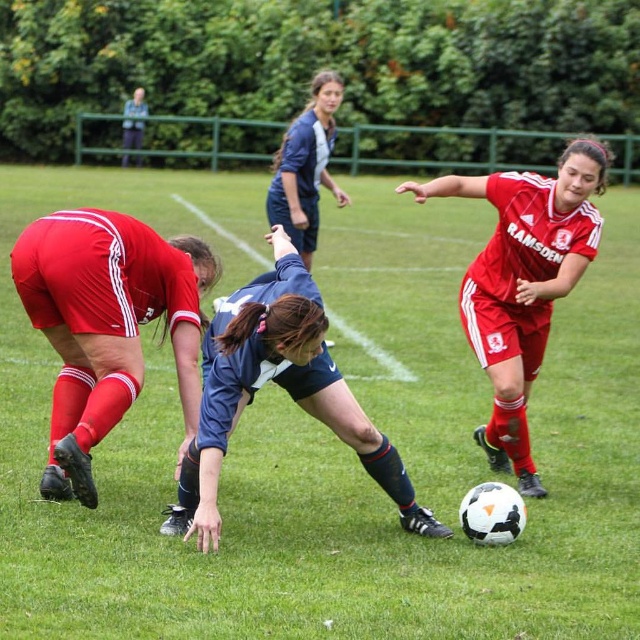
You are a soccer referee observing the match. You need to determine if the player in the navy blue jersey at center is taller than the player in the matte red shorts at lower left. Based on the scene description, what can you conclude?

The matte red shorts at lower left is not as tall as navy blue jersey at center, so the player in the navy blue jersey at center is taller than the player in the matte red shorts at lower left.

You are a soccer coach analyzing the game. You notice the navy blue jersey at center and the green grass football field at center. How far apart are they?

The green grass football field at center is 6.36 feet from navy blue jersey at center.